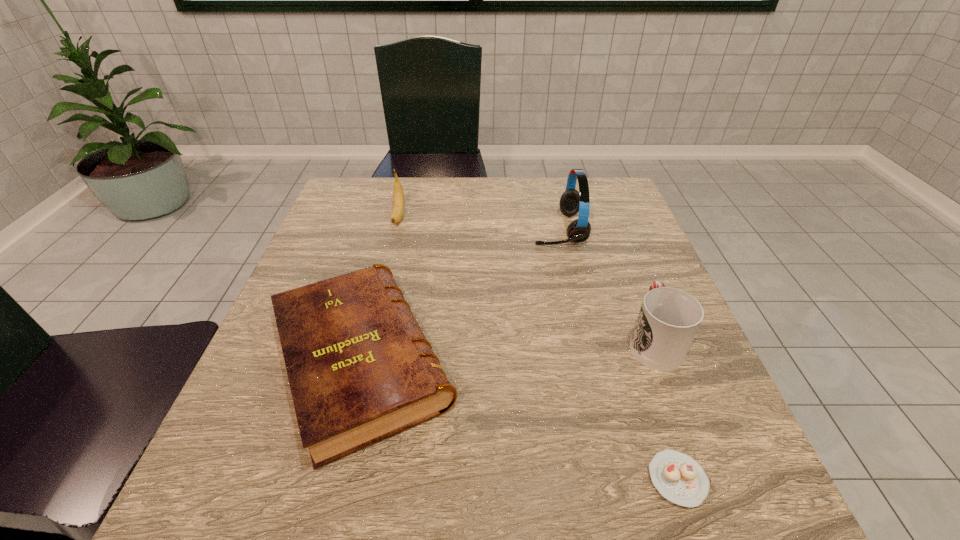
I want to click on the tallest object, so click(x=571, y=202).

The width and height of the screenshot is (960, 540). Identify the location of banana. (398, 208).

Find the location of a particular element. The width and height of the screenshot is (960, 540). cup is located at coordinates (669, 318).

Image resolution: width=960 pixels, height=540 pixels. Identify the location of the fourth tallest object. (360, 369).

Where is `the shortest object`? This screenshot has height=540, width=960. the shortest object is located at coordinates (678, 477).

Where is `free spot located with the microphone attached to the side of the headset`? The image size is (960, 540). free spot located with the microphone attached to the side of the headset is located at coordinates (442, 230).

Find the location of a particular element. This screenshot has width=960, height=540. vacant area situated 0.250m with the microphone attached to the side of the headset is located at coordinates (434, 230).

At what (x,y) coordinates should I click in order to perform the action: click on free space located 0.170m with the microphone attached to the side of the headset. Please return your answer as a coordinate pair (x, y). The image size is (960, 540). Looking at the image, I should click on (466, 230).

Where is `free region located 0.140m at the start of the peel on the banana`? free region located 0.140m at the start of the peel on the banana is located at coordinates (387, 266).

Where is `vacant space located 0.240m on the handle side of the cup`? This screenshot has width=960, height=540. vacant space located 0.240m on the handle side of the cup is located at coordinates (615, 244).